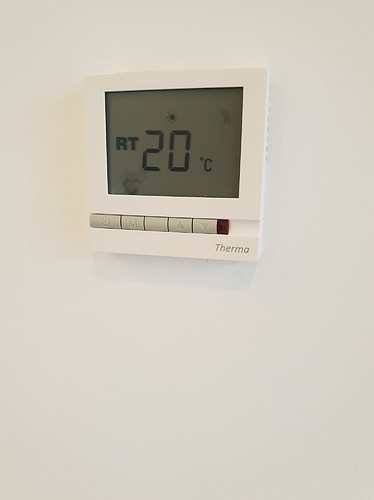
Identify the location of temperature up button. The image size is (374, 500). (181, 227).